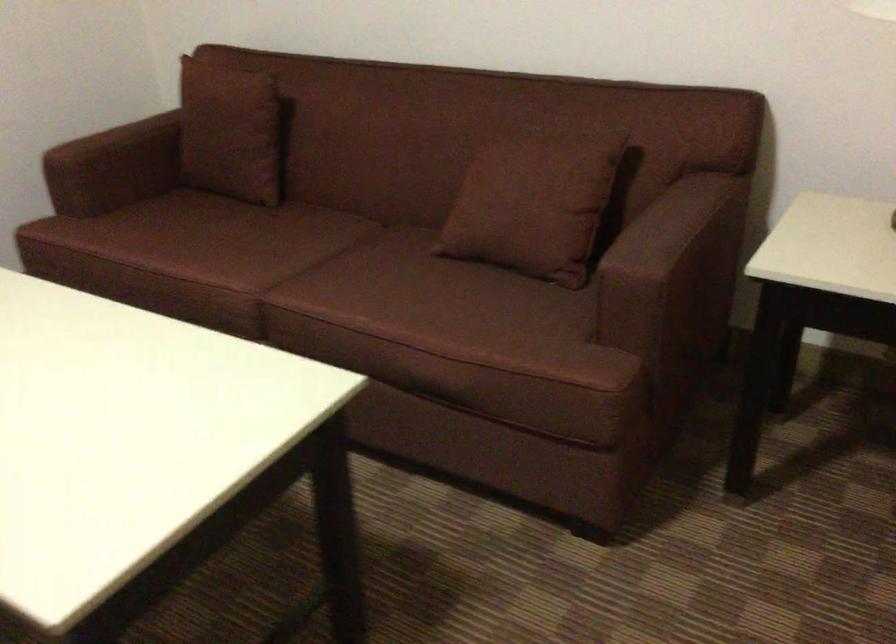
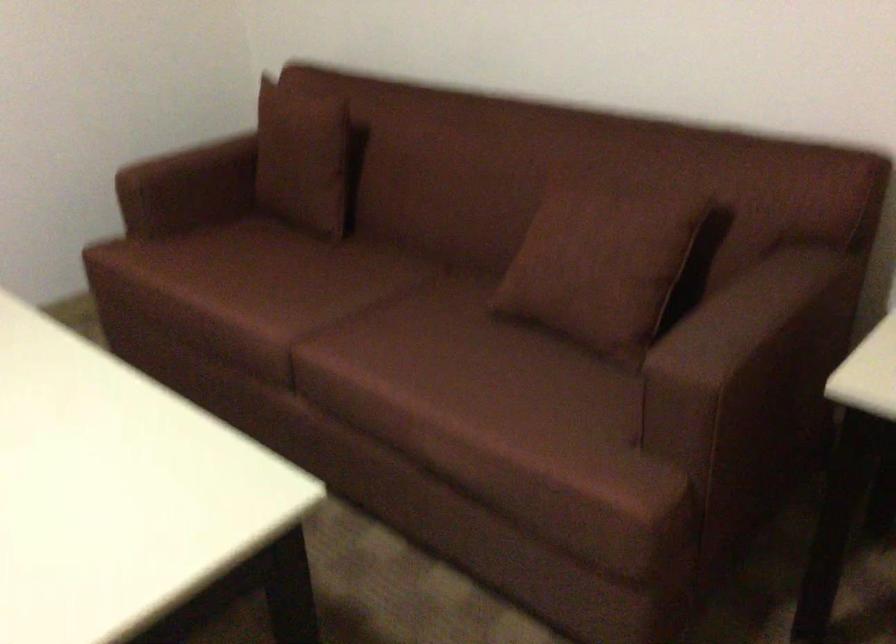
Question: The camera is either moving clockwise (left) or counter-clockwise (right) around the object. The first image is from the beginning of the video and the second image is from the end. Is the camera moving left or right when shooting the video?

Choices:
 (A) Left
 (B) Right

Answer: (B)